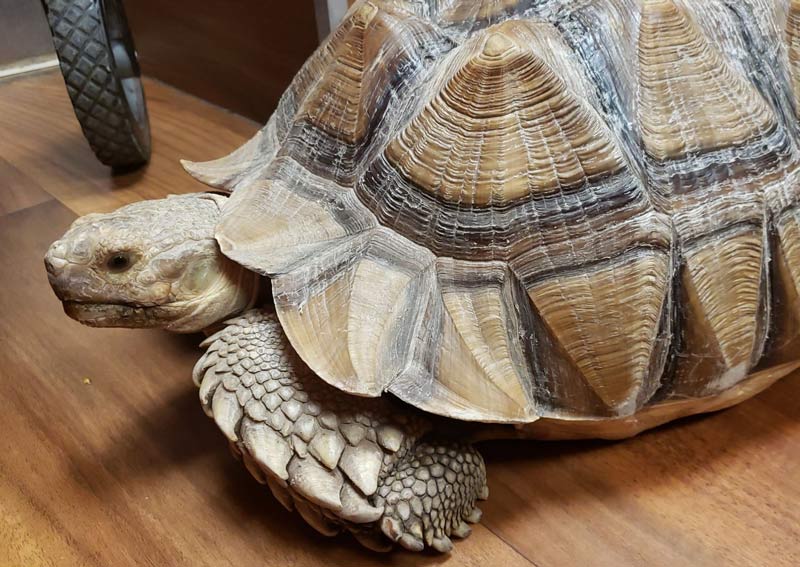
Where is `trim`? The image size is (800, 567). trim is located at coordinates (325, 14).